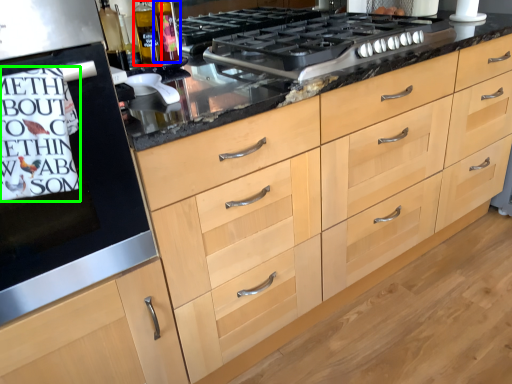
Question: Which object is positioned closest to bottle (highlighted by a red box)? Select from bottle (highlighted by a blue box) and writing (highlighted by a green box).

Choices:
 (A) bottle
 (B) writing

Answer: (A)